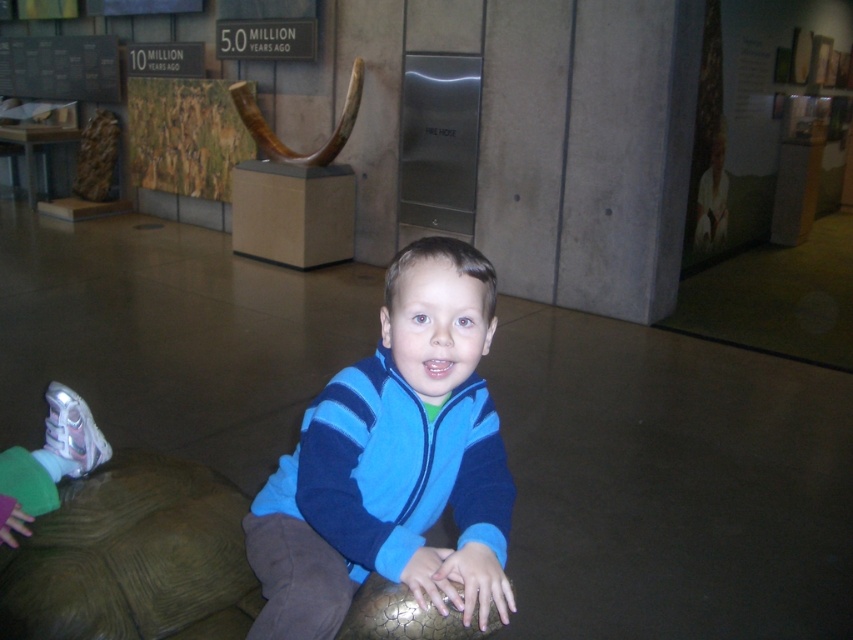
From the picture: You are a museum visitor who wants to take a photo of the brown textured tortoise at lower left without the blue fleece jacket at center appearing in the frame. Is this possible given their distance?

The blue fleece jacket at center is 12.96 inches away from the brown textured tortoise at lower left. Since the jacket is relatively close to the tortoise, it may be challenging to frame the photo so that the jacket is entirely out of view unless using a zoom lens or moving further back to reduce the field of view.

You are a visitor at the museum and want to take a photo of the blue fleece jacket at center and the brown textured tortoise at lower left. Which object should you focus on first if you want to capture both in the same frame without moving your camera?

The blue fleece jacket at center is taller than the brown textured tortoise at lower left, so you should focus on the blue fleece jacket at center first to ensure it fits within the frame.